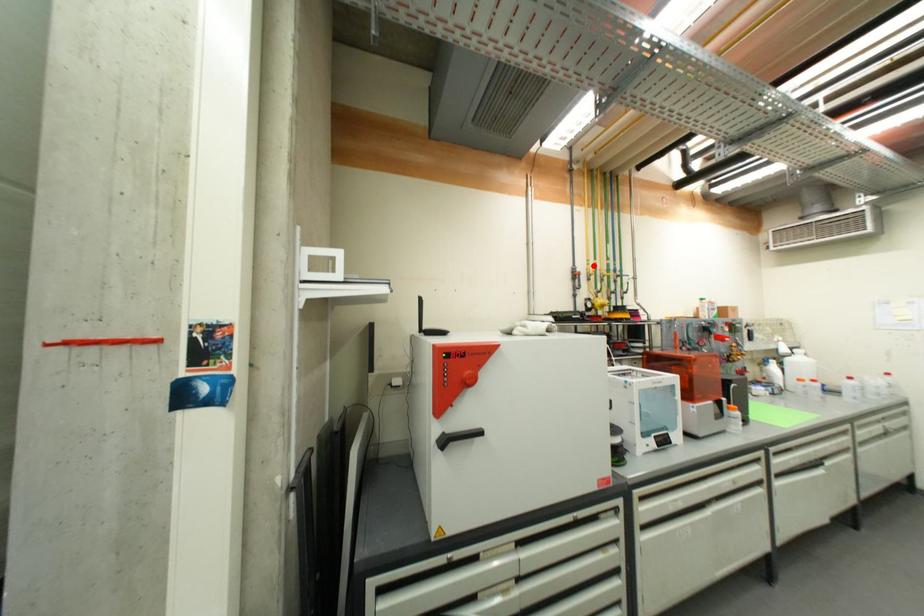
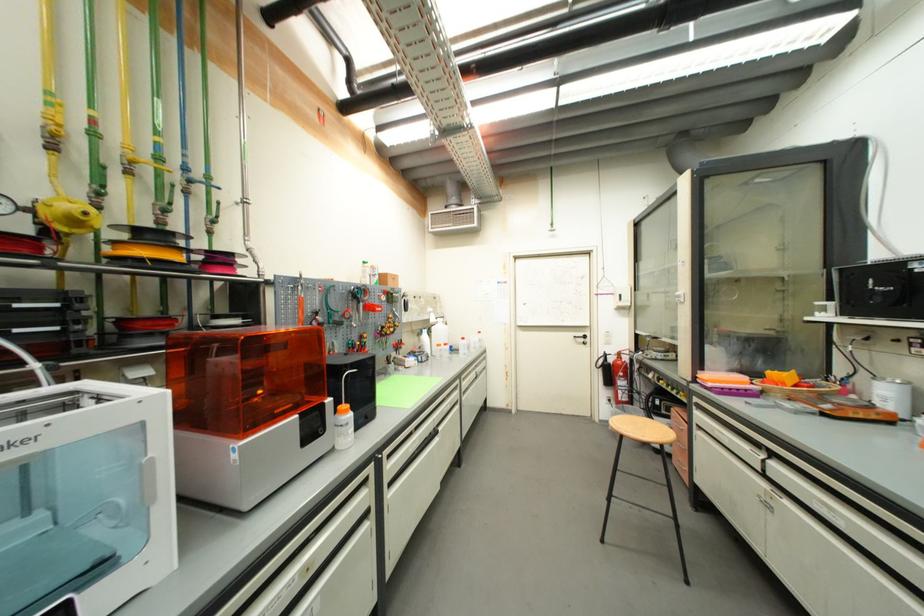
The point at the highlighted location is marked in the first image. Where is the corresponding point in the second image?

(55, 106)